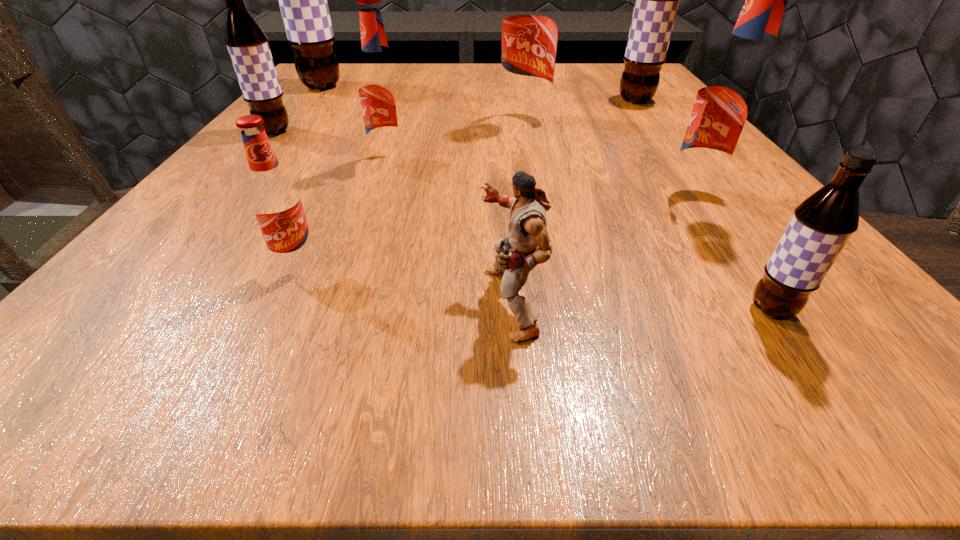
This screenshot has width=960, height=540. What are the coordinates of `the biggest brown root beer` in the screenshot? It's located at click(303, 3).

The image size is (960, 540). I want to click on the second red root beer from right to left, so click(x=530, y=20).

Find the location of a particular element. the fifth root beer from left to right is located at coordinates (530, 20).

What are the coordinates of `the second biggest brown root beer` in the screenshot? It's located at (656, 0).

The height and width of the screenshot is (540, 960). I want to click on the third smallest red root beer, so click(x=732, y=98).

You are a GUI agent. You are given a task and a screenshot of the screen. Output one action in this format:
    pyautogui.click(x=<x>, y=<y>)
    Task: Click on the sixth farthest root beer
    This screenshot has width=960, height=540.
    Given the screenshot: What is the action you would take?
    pyautogui.click(x=732, y=98)

Identify the location of the second nearest brown root beer. This screenshot has height=540, width=960. (247, 43).

Locate an element on the screen. the fifth root beer from right to left is located at coordinates (380, 88).

The image size is (960, 540). What are the coordinates of `the third red root beer from right to left` in the screenshot? It's located at (380, 88).

Identify the location of the leftmost red root beer. The image size is (960, 540). (275, 200).